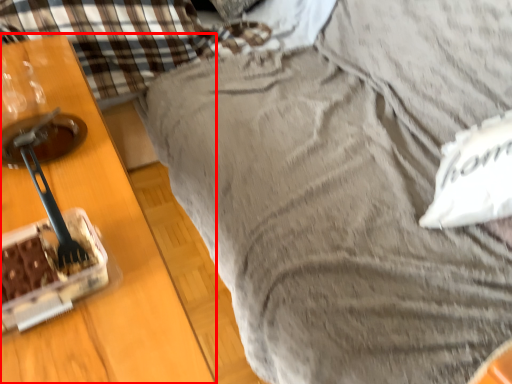
Question: In this image, where is furniture (annotated by the red box) located relative to pillow?

Choices:
 (A) left
 (B) right

Answer: (A)